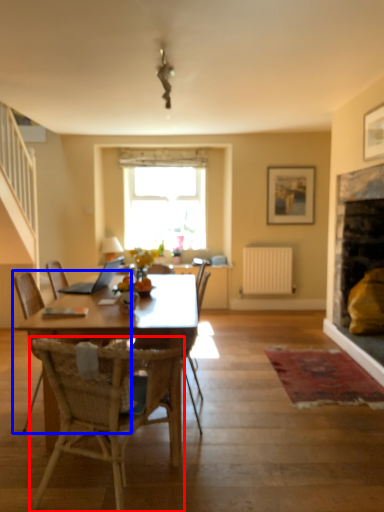
Question: Which object appears farthest to the camera in this image, chair (highlighted by a red box) or chair (highlighted by a blue box)?

Choices:
 (A) chair
 (B) chair

Answer: (B)